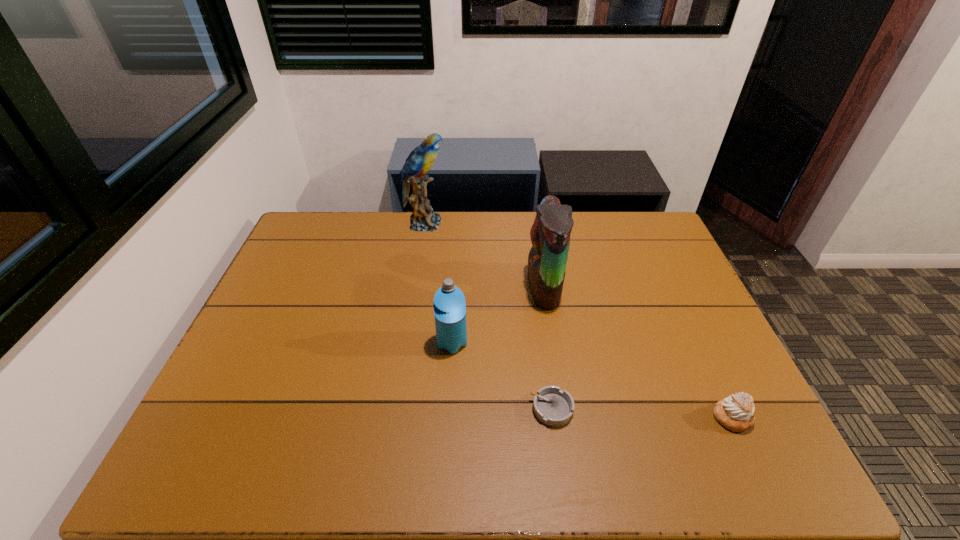
Find the location of a particular element. vacant space that satisfies the following two spatial constraints: 1. on the face of the fourth object from right to left; 2. on the right side of the leftmost object is located at coordinates (405, 343).

You are a GUI agent. You are given a task and a screenshot of the screen. Output one action in this format:
    pyautogui.click(x=<x>, y=<y>)
    Task: Click on the free region that satisfies the following two spatial constraints: 1. on the face of the leftmost object; 2. on the back side of the thermos bottle
    The height and width of the screenshot is (540, 960).
    Given the screenshot: What is the action you would take?
    pyautogui.click(x=405, y=343)

Image resolution: width=960 pixels, height=540 pixels. In order to click on vacant space that satisfies the following two spatial constraints: 1. on the face of the pastry; 2. on the left side of the leftmost object in this screenshot , I will do `click(393, 417)`.